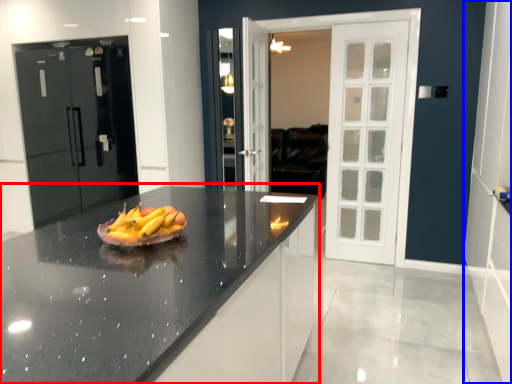
Question: Which object is closer to the camera taking this photo, countertop (highlighted by a red box) or side (highlighted by a blue box)?

Choices:
 (A) countertop
 (B) side

Answer: (A)